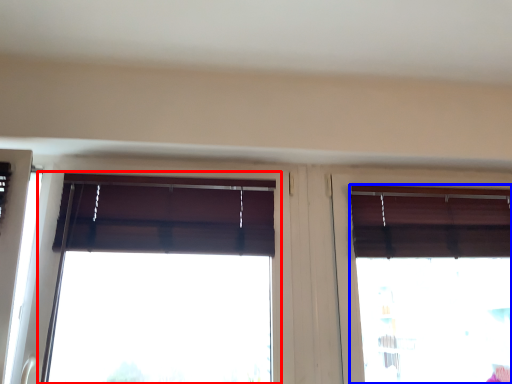
Question: Which point is further to the camera, window (highlighted by a red box) or window (highlighted by a blue box)?

Choices:
 (A) window
 (B) window

Answer: (B)